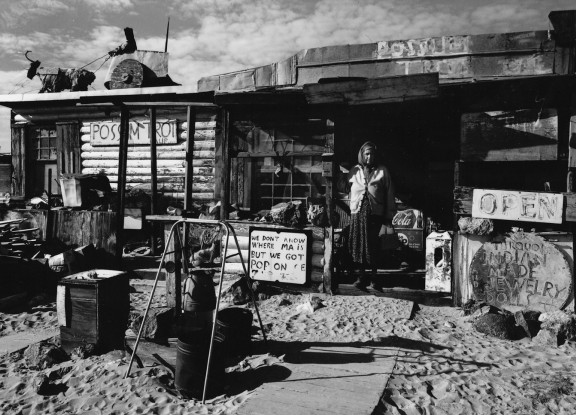
I want to click on doorway, so click(x=411, y=166).